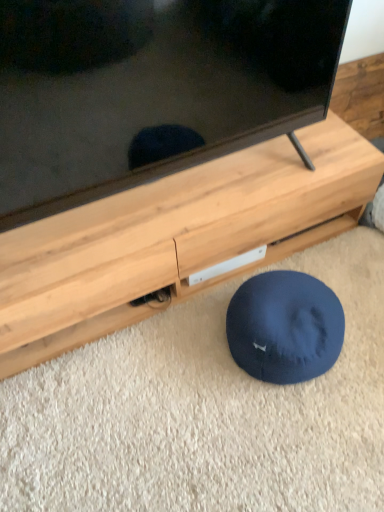
The image size is (384, 512). What are the coordinates of `free space above navy blue fabric dog bed at lower center (from a real-world perspective)` in the screenshot? It's located at (287, 300).